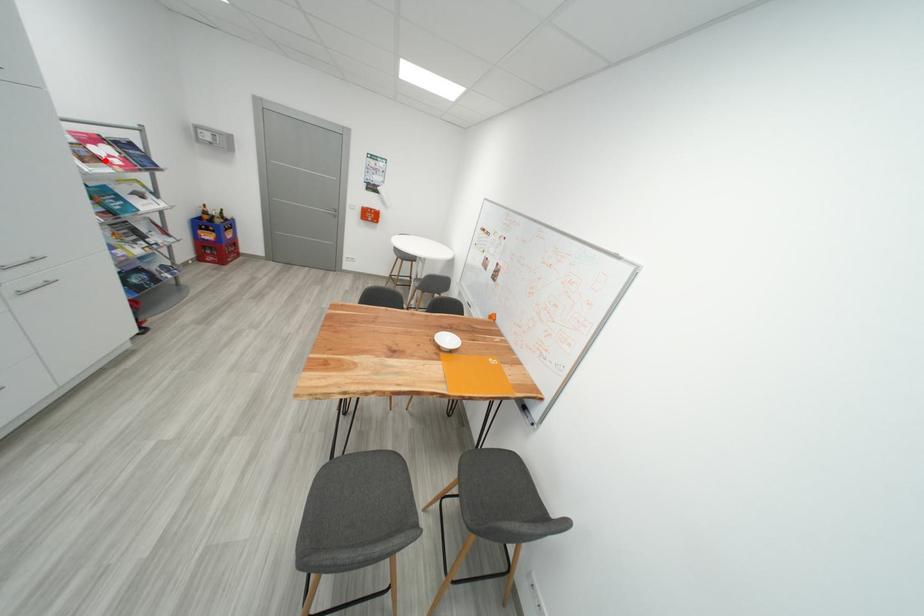
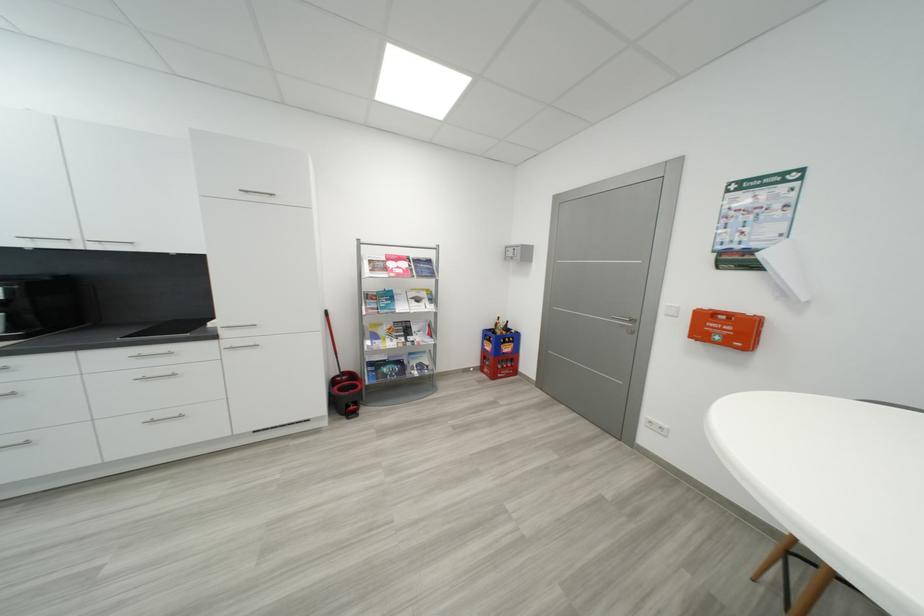
Locate, in the second image, the point that corresponds to the highlighted location in the first image.

(393, 270)